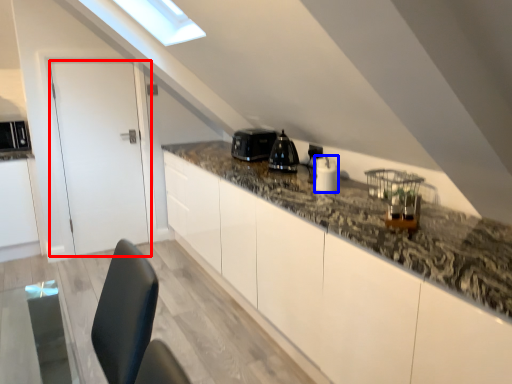
Question: Which point is closer to the camera, door (highlighted by a red box) or appliance (highlighted by a blue box)?

Choices:
 (A) door
 (B) appliance

Answer: (B)